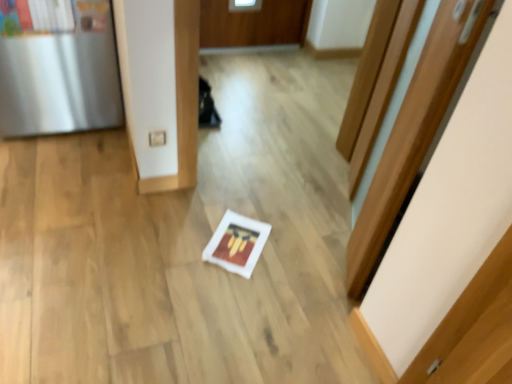
The width and height of the screenshot is (512, 384). I want to click on vacant space positioned to the left of wooden door at center, so click(252, 226).